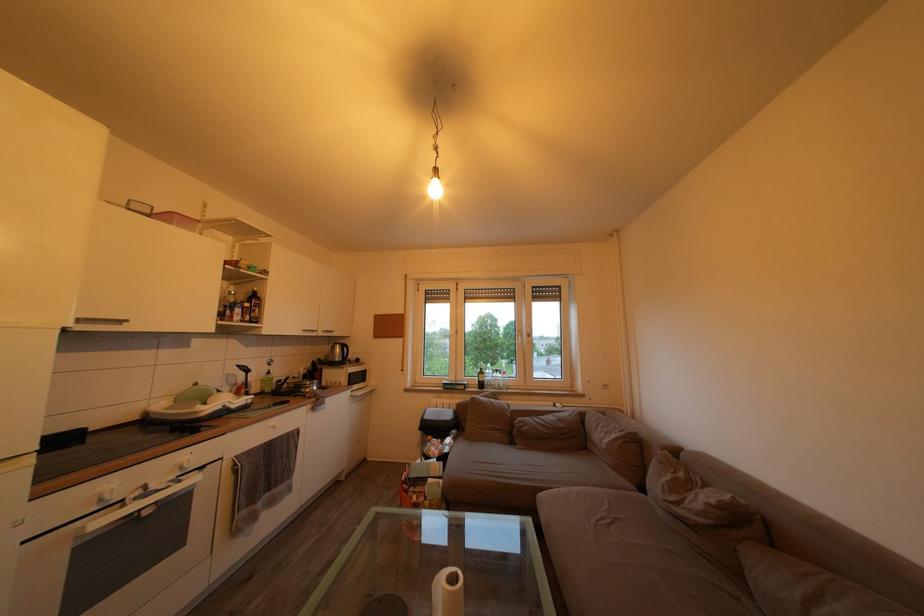
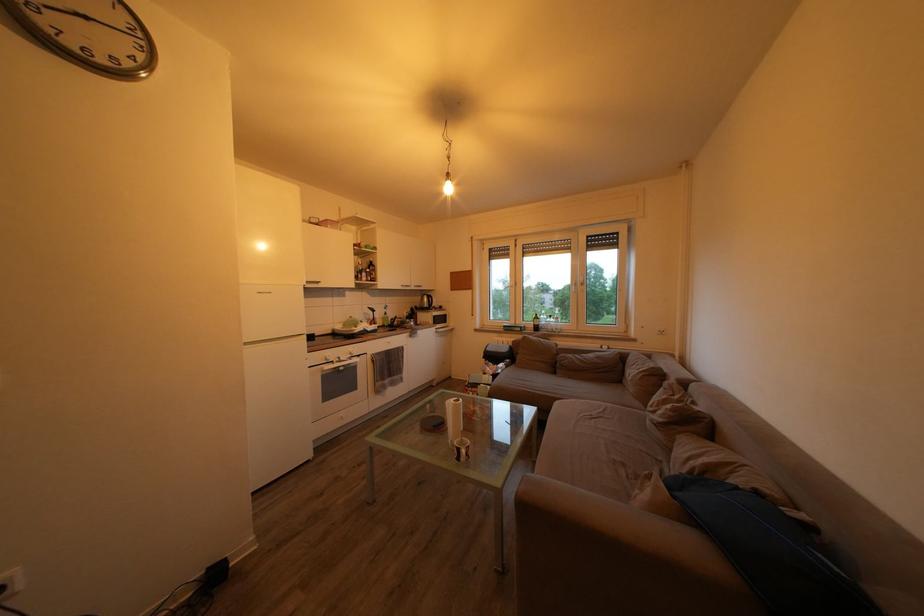
Where in the second image is the point corresponding to point (162, 493) from the first image?

(349, 363)